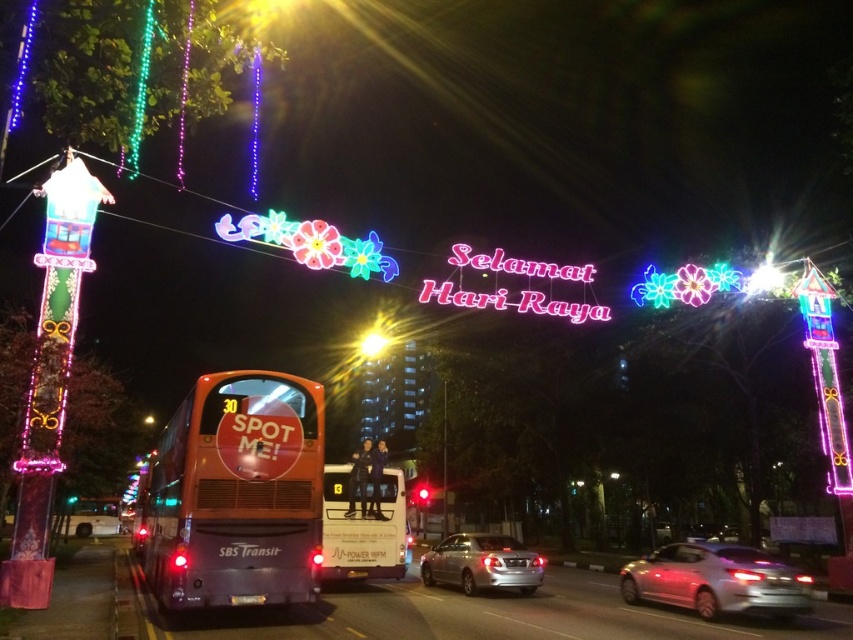
Which is behind, point (370, 520) or point (433, 570)?

The point (433, 570) is more distant.

Find the location of a particular element. The height and width of the screenshot is (640, 853). matte orange bus at center is located at coordinates 363,529.

How distant is orange matte/decorative bus at lower left from silver metallic sedan at center?

orange matte/decorative bus at lower left is 6.87 meters away from silver metallic sedan at center.

Is orange matte/decorative bus at lower left to the right of silver metallic sedan at center from the viewer's perspective?

In fact, orange matte/decorative bus at lower left is to the left of silver metallic sedan at center.

Measure the distance between orange matte/decorative bus at lower left and camera.

A distance of 10.56 meters exists between orange matte/decorative bus at lower left and camera.

The image size is (853, 640). What are the coordinates of `orange matte/decorative bus at lower left` in the screenshot? It's located at (236, 493).

Is orange matte/decorative bus at lower left positioned in front of matte orange bus at center?

Yes, orange matte/decorative bus at lower left is closer to the viewer.

Can you confirm if orange matte/decorative bus at lower left is positioned above matte orange bus at center?

Indeed, orange matte/decorative bus at lower left is positioned over matte orange bus at center.

Between point (248, 445) and point (363, 536), which one is positioned in front?

Point (248, 445)

Find the location of a particular element. This screenshot has width=853, height=640. orange matte/decorative bus at lower left is located at coordinates (236, 493).